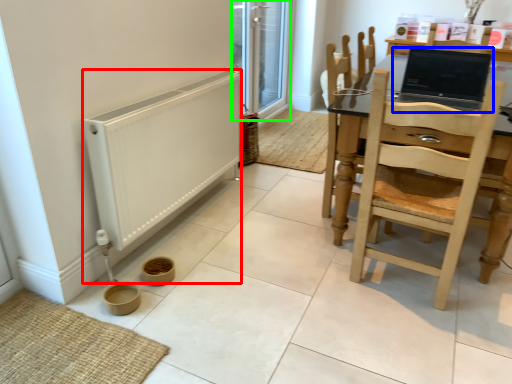
Question: Based on their relative distances, which object is farther from heater (highlighted by a red box)? Choose from laptop (highlighted by a blue box) and screen door (highlighted by a green box).

Choices:
 (A) laptop
 (B) screen door

Answer: (B)